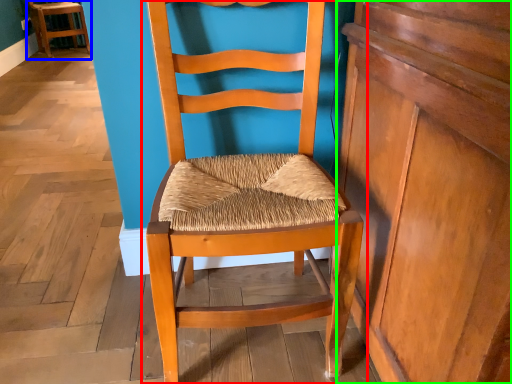
Question: Estimate the real-world distances between objects in this image. Which object is closer to chair (highlighted by a red box), chair (highlighted by a blue box) or dresser (highlighted by a green box)?

Choices:
 (A) chair
 (B) dresser

Answer: (B)